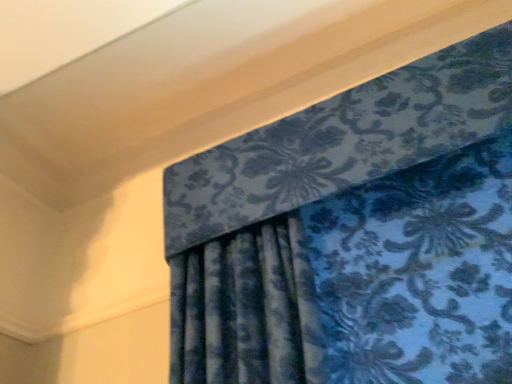
This screenshot has width=512, height=384. What do you see at coordinates (354, 234) in the screenshot? I see `velvet blue curtain at upper center` at bounding box center [354, 234].

Measure the distance between velvet blue curtain at upper center and camera.

The depth of velvet blue curtain at upper center is 37.84 inches.

You are a GUI agent. You are given a task and a screenshot of the screen. Output one action in this format:
    pyautogui.click(x=<x>, y=<y>)
    Task: Click on the velvet blue curtain at upper center
    
    Given the screenshot: What is the action you would take?
    pyautogui.click(x=354, y=234)

This screenshot has width=512, height=384. What are the coordinates of `velvet blue curtain at upper center` in the screenshot? It's located at (354, 234).